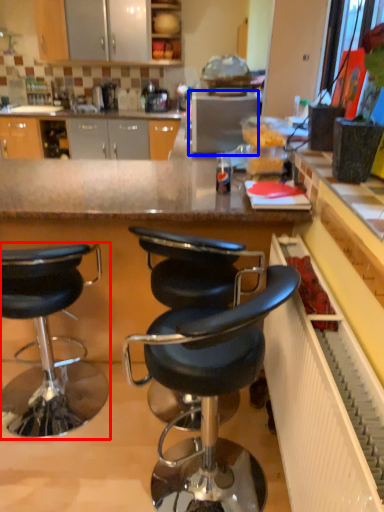
Question: Which object is further to the camera taking this photo, chair (highlighted by a red box) or appliance (highlighted by a blue box)?

Choices:
 (A) chair
 (B) appliance

Answer: (B)